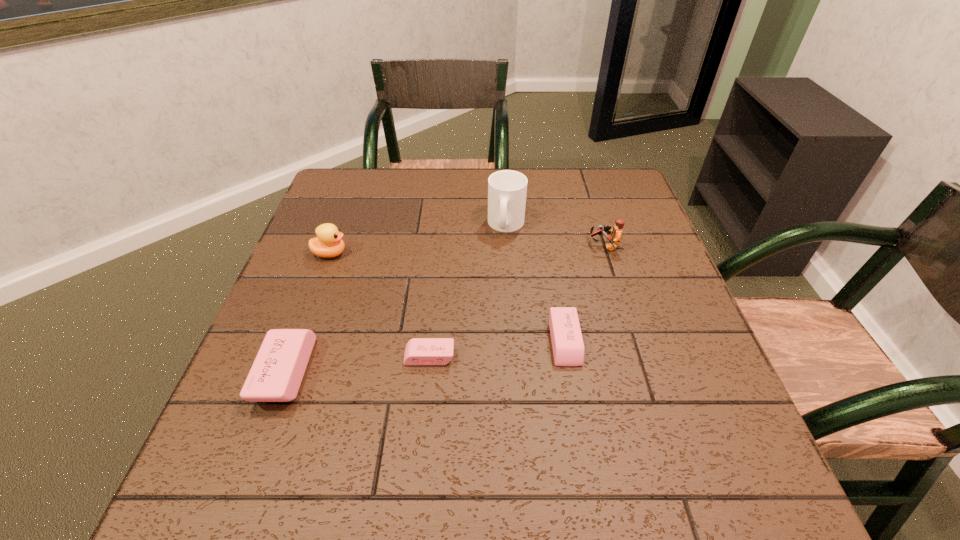
Please show where to add a eraser on the right while keeping spacing even. Please provide its 2D coordinates. Your answer should be formatted as a tuple, i.e. [(x, y)], where the tuple contains the x and y coordinates of a point satisfying the conditions above.

[(692, 328)]